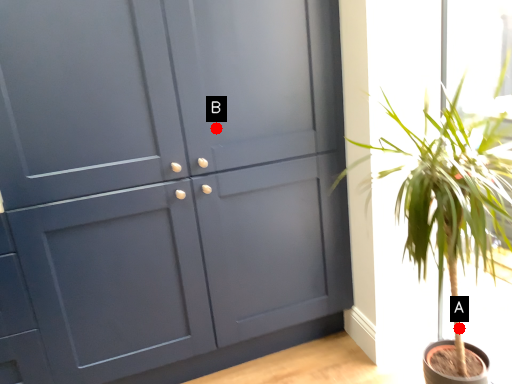
Question: Two points are circled on the image, labeled by A and B beside each circle. Which point is closer to the camera?

Choices:
 (A) A is closer
 (B) B is closer

Answer: (A)